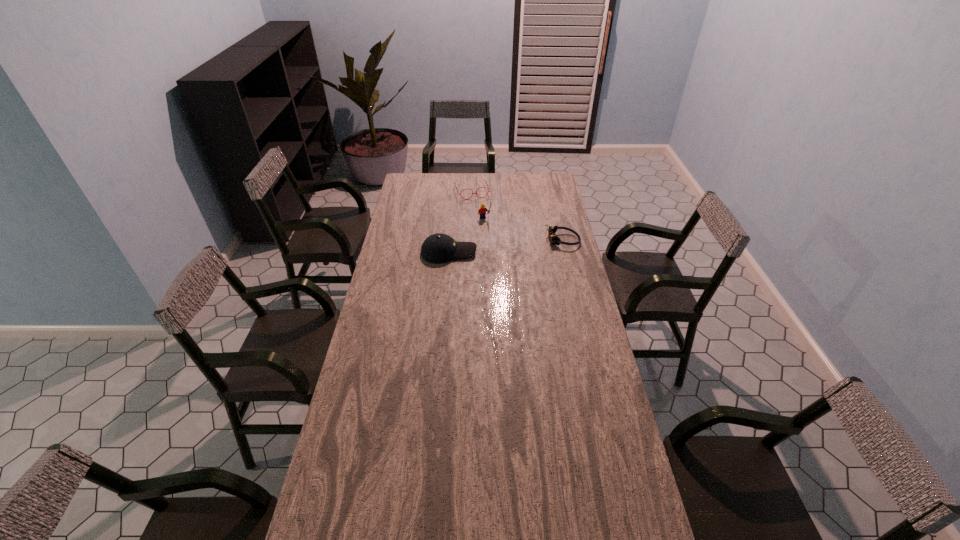
Where is `vacant space situated on the front-facing side of the second farthest object`? This screenshot has width=960, height=540. vacant space situated on the front-facing side of the second farthest object is located at coordinates (x=503, y=244).

This screenshot has height=540, width=960. I want to click on free spot located 0.110m on the front-facing side of the second farthest object, so click(495, 234).

This screenshot has width=960, height=540. I want to click on object that is at the far edge, so click(x=483, y=180).

The image size is (960, 540). Find the location of `object at the right edge`. object at the right edge is located at coordinates (553, 238).

Identify the location of vacant space at the far edge of the desktop. (468, 190).

The width and height of the screenshot is (960, 540). In the image, there is a desktop. In order to click on free space at the near edge in this screenshot , I will do `click(406, 527)`.

In the image, there is a desktop. Identify the location of free space at the left edge. (332, 465).

Image resolution: width=960 pixels, height=540 pixels. I want to click on vacant region at the right edge of the desktop, so click(x=615, y=448).

Identify the location of free space between the tallest object and the goggles. (523, 230).

I want to click on free space between the third shortest object and the Lego, so click(x=467, y=236).